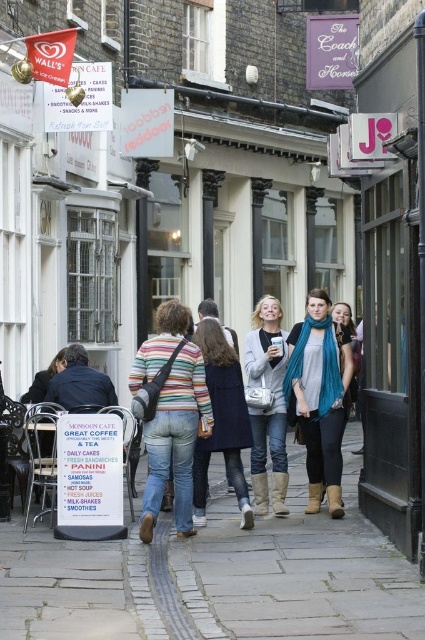
Does point (172, 598) come closer to viewer compared to point (201, 490)?

Yes, it is in front of point (201, 490).

Between gray stone pavement at center and striped fabric sweater at center, which one has less height?

gray stone pavement at center is shorter.

Is point (153, 624) positioned in front of point (206, 461)?

Yes, point (153, 624) is in front of point (206, 461).

Where is `gray stone pavement at center`? This screenshot has width=425, height=640. gray stone pavement at center is located at coordinates (217, 577).

Where is `gray stone pavement at center`? gray stone pavement at center is located at coordinates (217, 577).

Is point (214, 573) positioned in front of point (197, 416)?

Yes, it is.

You are a GUI agent. You are given a task and a screenshot of the screen. Output one action in this format:
    pyautogui.click(x=<x>, y=<y>)
    Task: Click on the gray stone pavement at center
    This screenshot has width=425, height=640.
    Given the screenshot: What is the action you would take?
    pyautogui.click(x=217, y=577)

Consider the image. Measure the distance between teal scarf at center and striped fabric sweater at center.

A distance of 1.18 meters exists between teal scarf at center and striped fabric sweater at center.

Who is positioned more to the right, teal scarf at center or striped fabric sweater at center?

teal scarf at center

Does point (340, 333) lie behind point (218, 368)?

Yes, it is behind point (218, 368).

I want to click on teal scarf at center, so click(x=320, y=396).